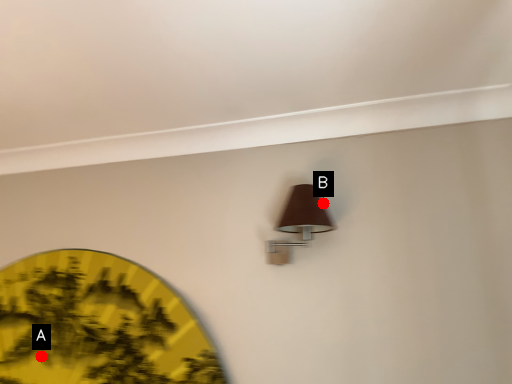
Question: Two points are circled on the image, labeled by A and B beside each circle. Which point is closer to the camera?

Choices:
 (A) A is closer
 (B) B is closer

Answer: (B)